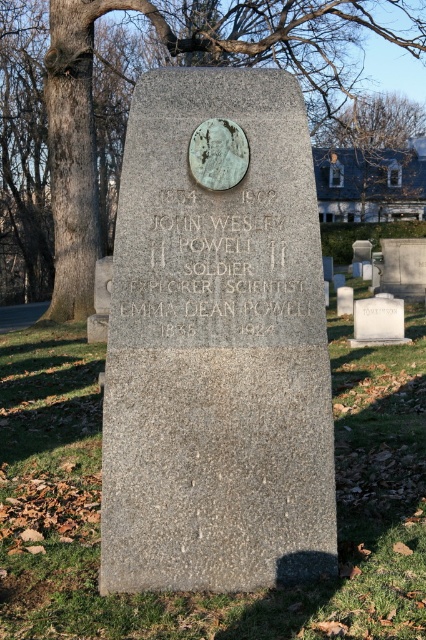
Question: Which point is closer to the camera taking this photo?

Choices:
 (A) (258, 204)
 (B) (385, 324)

Answer: (A)

Question: Can you confirm if brown bark tree at upper left is positioned below bare branches at upper center?

Choices:
 (A) yes
 (B) no

Answer: (B)

Question: From the image, what is the correct spatial relationship of brown bark tree at upper left in relation to white marble gravestone at center?

Choices:
 (A) above
 (B) below

Answer: (A)

Question: Which object appears closest to the camera in this image?

Choices:
 (A) brown bark tree at upper left
 (B) white marble gravestone at center

Answer: (B)

Question: Is brown bark tree at upper left closer to camera compared to bronze plaque at center?

Choices:
 (A) yes
 (B) no

Answer: (B)

Question: Among these points, which one is nearest to the camera?

Choices:
 (A) (155, 476)
 (B) (386, 310)

Answer: (A)